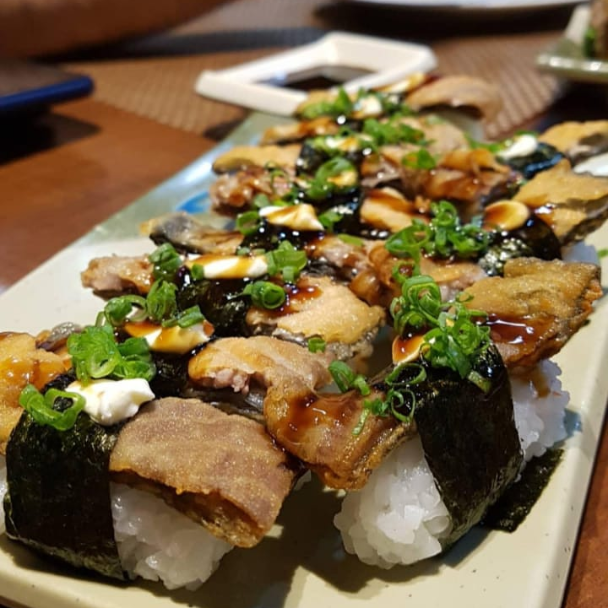
The image size is (608, 608). I want to click on tablecloths, so click(x=491, y=63), click(x=157, y=98).